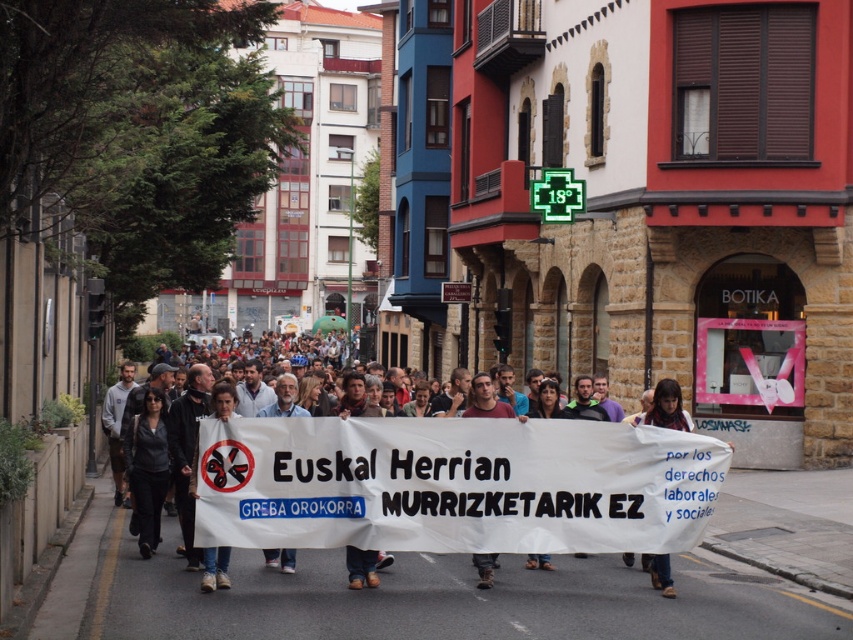
Based on the photo, which is above, white paper banner at center or dark brown leather shoes at lower center?

dark brown leather shoes at lower center is higher up.

Does white paper banner at center have a lesser width compared to dark brown leather shoes at lower center?

No, white paper banner at center is not thinner than dark brown leather shoes at lower center.

Which is in front, point (473, 544) or point (650, 563)?

Point (473, 544)

I want to click on white paper banner at center, so click(x=451, y=484).